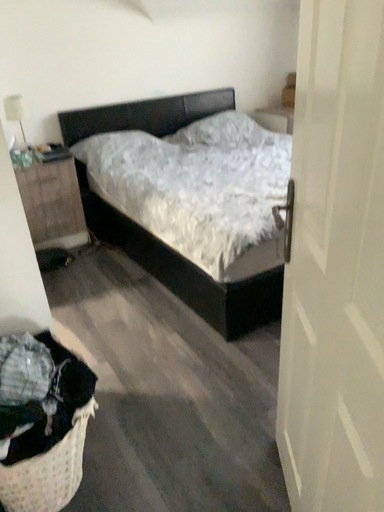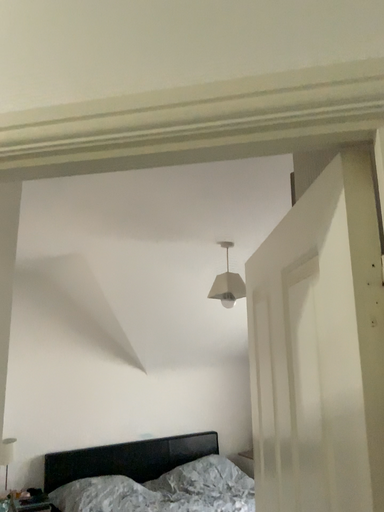
Question: How did the camera likely rotate when shooting the video?

Choices:
 (A) rotated upward
 (B) rotated downward

Answer: (A)